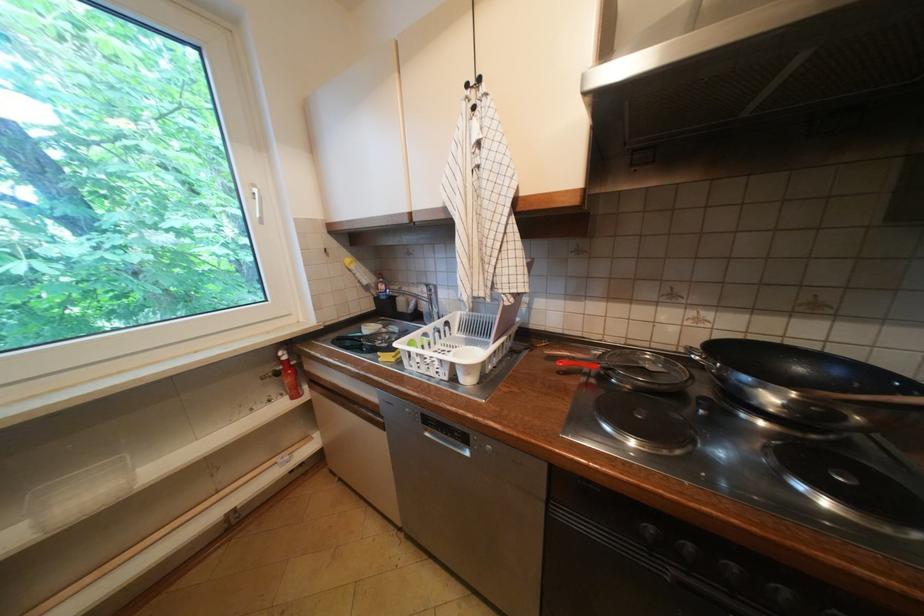
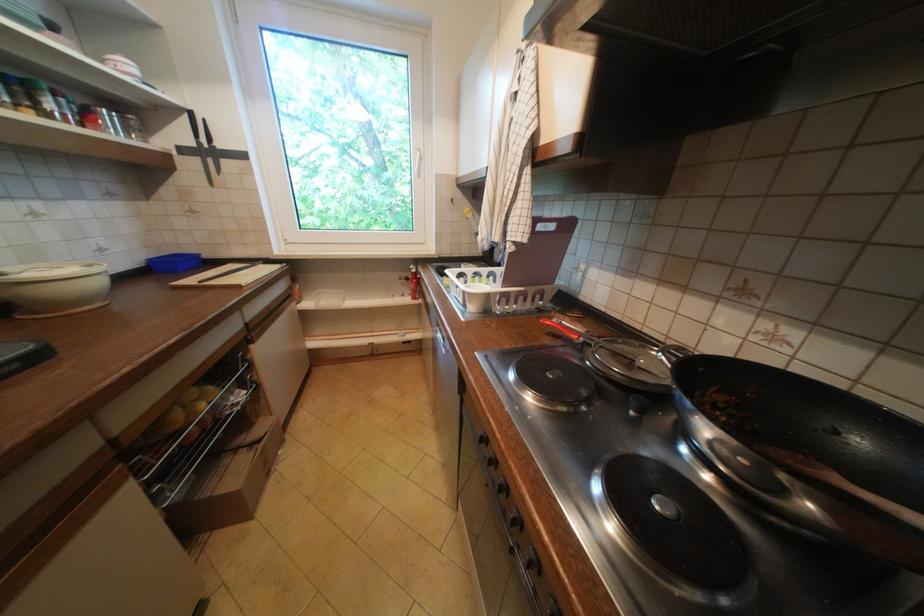
Find the pixel in the second image that matches point 535,345 in the first image.

(565, 310)